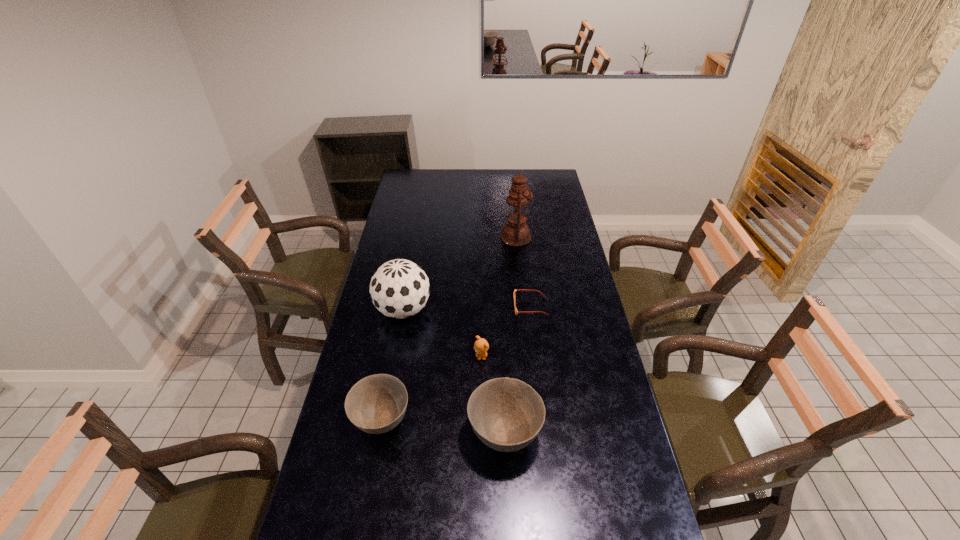
The width and height of the screenshot is (960, 540). Find the location of `free space at the far edge of the desktop`. free space at the far edge of the desktop is located at coordinates (500, 181).

Image resolution: width=960 pixels, height=540 pixels. In the image, there is a desktop. What are the coordinates of `blank space at the left edge` in the screenshot? It's located at (398, 194).

At what (x,y) coordinates should I click in order to perform the action: click on free space at the right edge. Please return your answer as a coordinate pair (x, y). The image size is (960, 540). Looking at the image, I should click on (548, 221).

In the image, there is a desktop. At what (x,y) coordinates should I click in order to perform the action: click on vacant space at the near left corner. Please return your answer as a coordinate pair (x, y). This screenshot has height=540, width=960. Looking at the image, I should click on (345, 507).

In the image, there is a desktop. Where is `free space at the far right corner`? free space at the far right corner is located at coordinates (547, 174).

The height and width of the screenshot is (540, 960). I want to click on empty space between the right bowl and the shorter bowl, so click(x=443, y=427).

Find the location of a particular element. vacant area that lies between the fourth tallest object and the oil lamp is located at coordinates (448, 329).

Locate an element on the screen. This screenshot has height=540, width=960. blank region between the soccer ball and the shortest object is located at coordinates (467, 308).

At what (x,y) coordinates should I click in order to perform the action: click on vacant area that lies between the third shortest object and the teddy bear. Please return your answer as a coordinate pair (x, y). Looking at the image, I should click on (431, 388).

You are a GUI agent. You are given a task and a screenshot of the screen. Output one action in this format:
    pyautogui.click(x=<x>, y=<y>)
    Task: Click on the free spot between the soccer ball and the left bowl
    This screenshot has height=540, width=960.
    Given the screenshot: What is the action you would take?
    pyautogui.click(x=393, y=365)